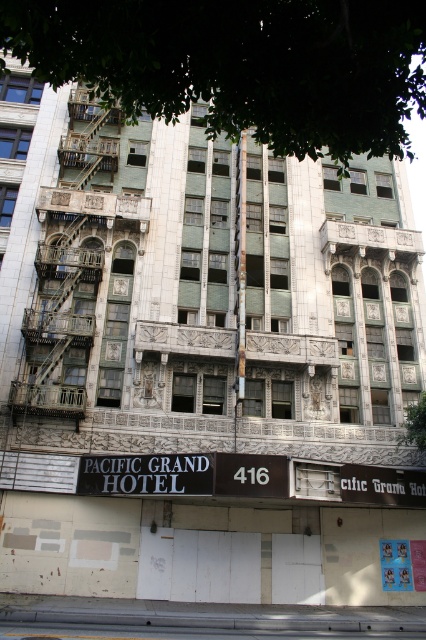
Question: Is black matte sign at lower right to the left of green leafy tree at center from the viewer's perspective?

Choices:
 (A) no
 (B) yes

Answer: (B)

Question: Is green leafy tree at upper center above black plastic sign at center?

Choices:
 (A) yes
 (B) no

Answer: (A)

Question: Is black plastic sign at center bigger than black matte sign at lower right?

Choices:
 (A) yes
 (B) no

Answer: (B)

Question: Which point is closer to the camera?

Choices:
 (A) (77, 484)
 (B) (400, 438)
 (C) (115, 35)

Answer: (C)

Question: Based on their relative distances, which object is farther from the black plastic sign at center?

Choices:
 (A) black metal sign at center
 (B) black matte sign at lower right
 (C) green leafy tree at center
 (D) green leafy tree at upper center

Answer: (D)

Question: Which of the following is the closest to the observer?

Choices:
 (A) (411, 506)
 (B) (400, 438)
 (C) (120, 476)

Answer: (C)